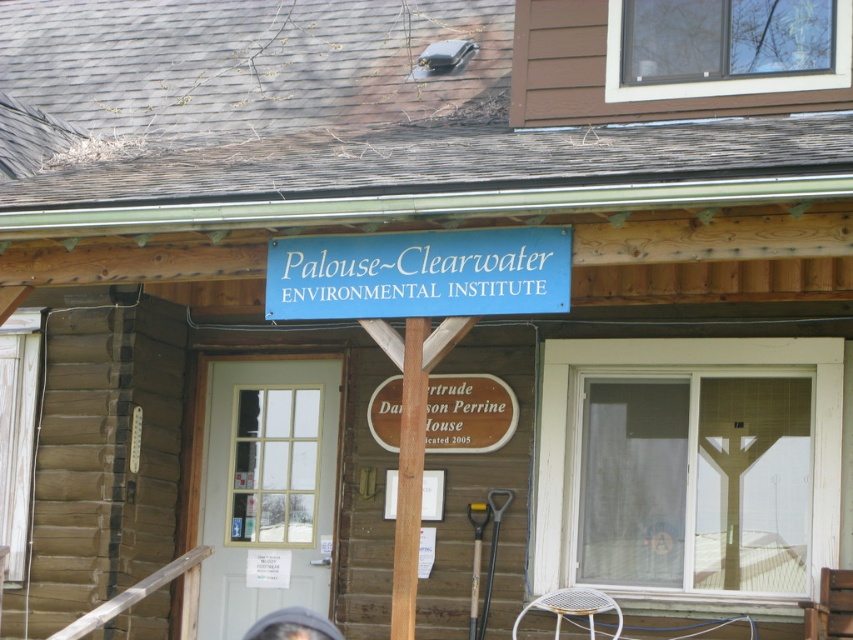
From the picture: You are standing in front of the wooden building and notice two signs. The blue matte sign at center and the dark brown hair at center. Which sign is located to the right of the other?

The blue matte sign at center is positioned on the right side of dark brown hair at center.

Consider the image. You are a visitor approaching the entrance of the wooden building. You see the blue matte sign at center and the dark brown hair at center. Which object is positioned higher relative to the other?

The blue matte sign at center is located above the dark brown hair at center, so it is positioned higher.

You are a visitor approaching the entrance of the wooden building. You notice the blue matte sign at center and the dark brown hair at center. Which object is larger in size?

The blue matte sign at center is bigger than the dark brown hair at center.